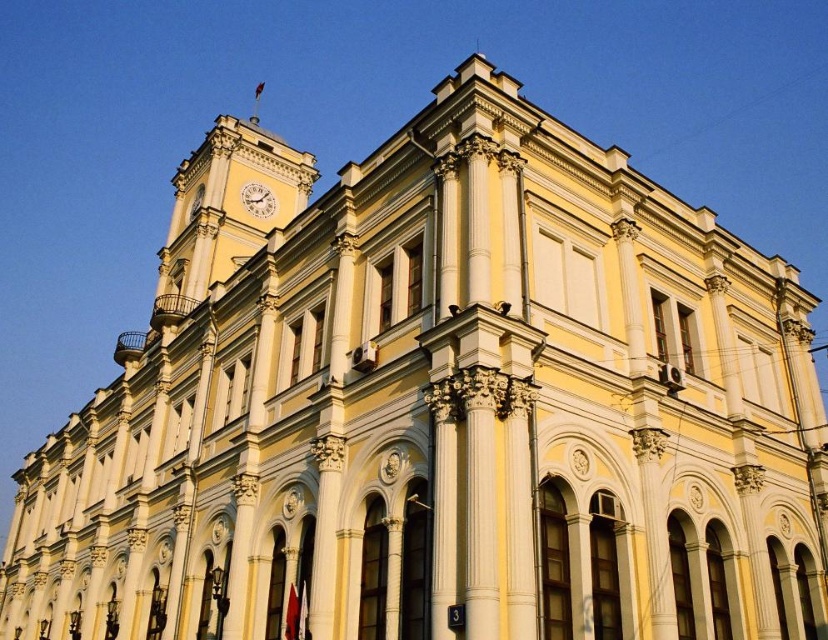
Question: Which object is closer to the camera taking this photo?

Choices:
 (A) white glossy clock at upper center
 (B) yellow stone clock tower at upper left

Answer: (B)

Question: Which object appears closest to the camera in this image?

Choices:
 (A) yellow stone clock tower at upper left
 (B) white glossy clock at upper center

Answer: (A)

Question: Does yellow stone clock tower at upper left appear over white glossy clock at upper center?

Choices:
 (A) yes
 (B) no

Answer: (A)

Question: Can you confirm if yellow stone clock tower at upper left is thinner than white glossy clock at upper center?

Choices:
 (A) yes
 (B) no

Answer: (B)

Question: Is yellow stone clock tower at upper left bigger than white glossy clock at upper center?

Choices:
 (A) yes
 (B) no

Answer: (A)